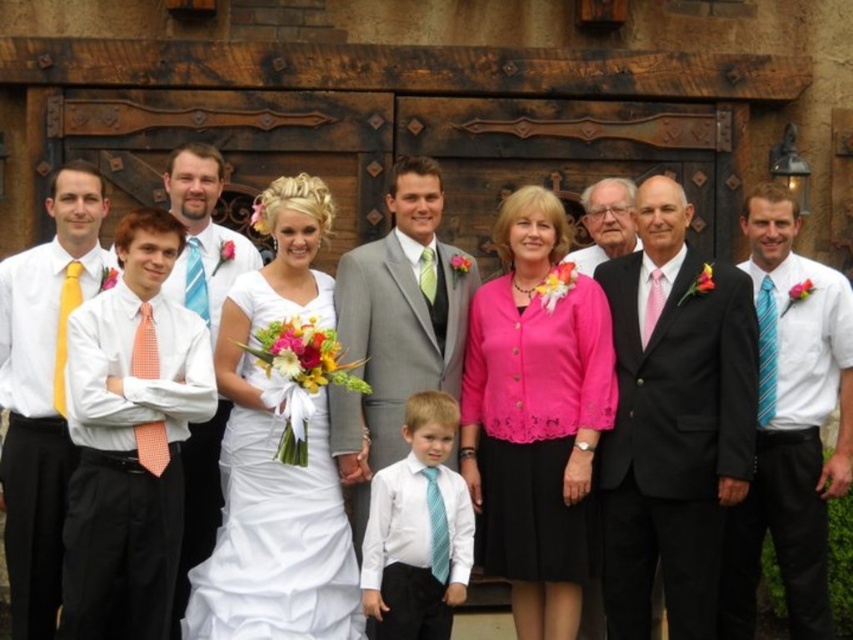
You are a photographer setting up for a group photo. You notice the black satin suit at center and the white satin dress at center. Which one has a wider silhouette?

The white satin dress at center has a wider silhouette than the black satin suit at center.

Consider the image. You are a photographer setting up for a group photo. You notice the black satin suit at center and the white satin dress at center in the scene. Which one should you focus on first if you want to capture both subjects at their full height in the frame?

The black satin suit at center is taller than the white satin dress at center, so you should focus on the black satin suit at center first to ensure its full height is captured in the frame.

Based on the scene description, what is the color of the suit worn by the person standing at the coordinates point (672,422)?

The point (672,422) corresponds to the black satin suit at center, so the color is black.